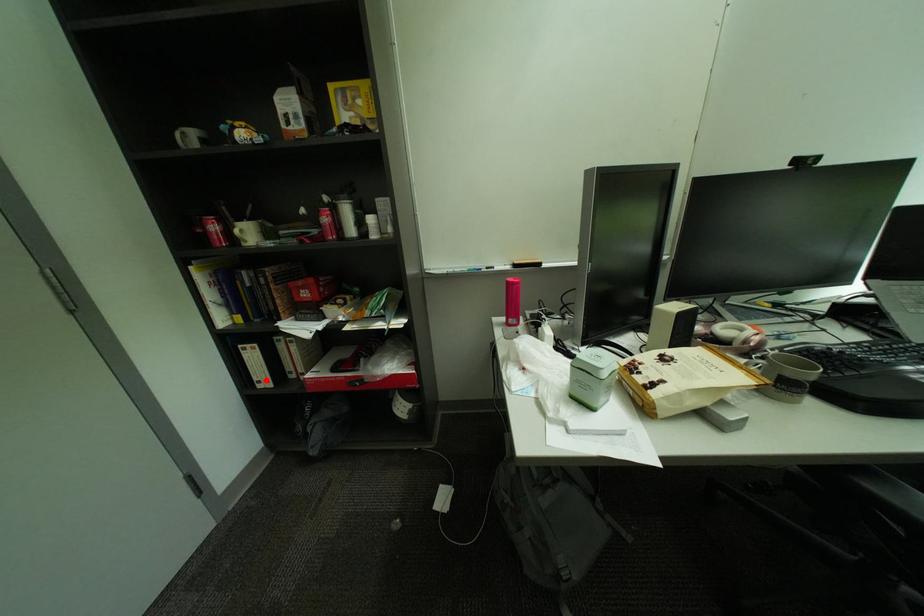
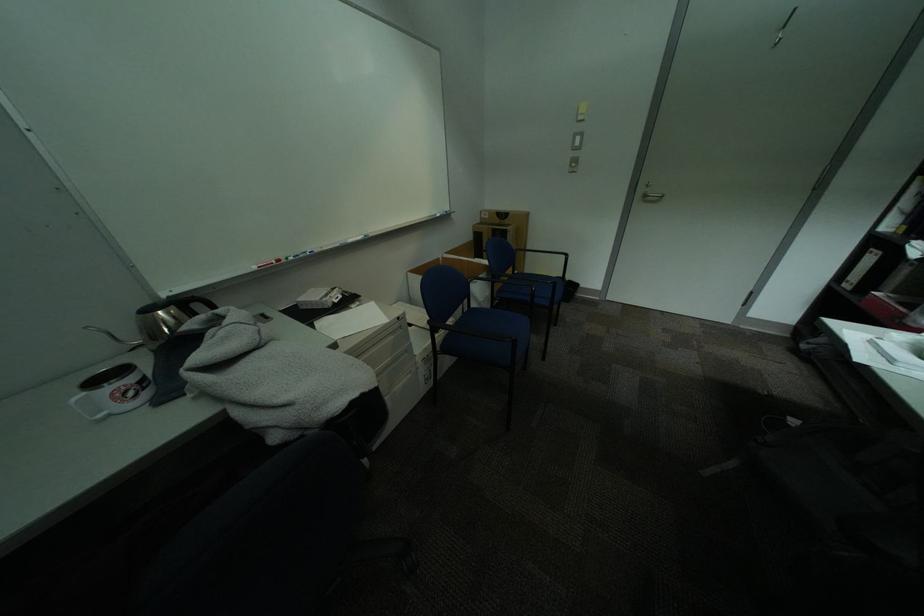
Question: I am providing you with two images of the same scene from different viewpoints. In image1, a red point is highlighted. Considering the same 3D point in image2, which of the following is correct?

Choices:
 (A) It is closer
 (B) It is farther

Answer: (B)